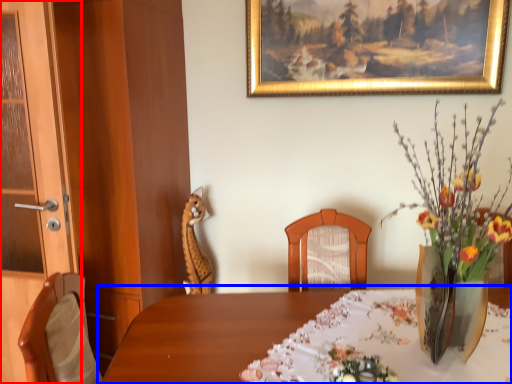
Question: Which point is further to the camera, door (highlighted by a red box) or table (highlighted by a blue box)?

Choices:
 (A) door
 (B) table

Answer: (A)